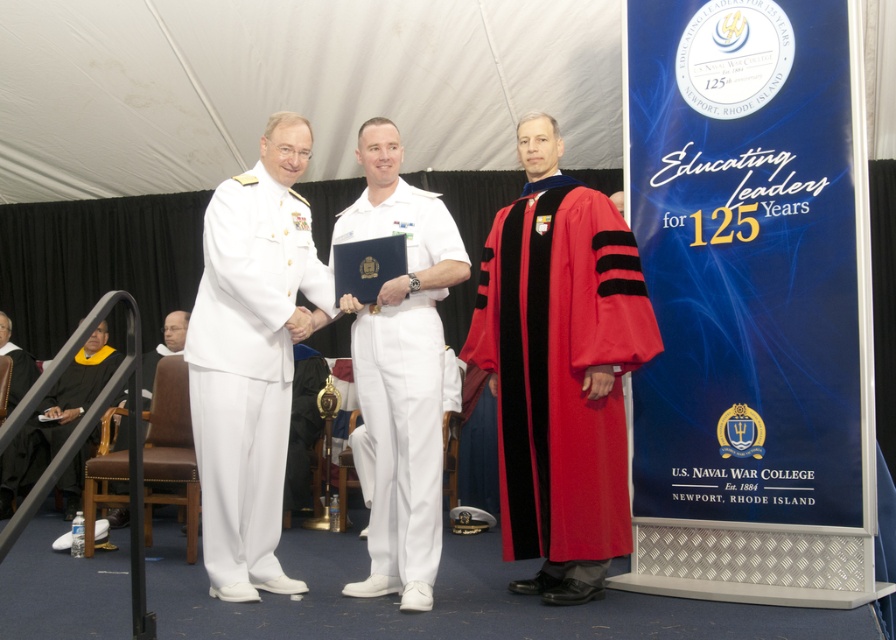
Please provide the 2D coordinates of the white cotton uniform at center in the scene.

The 2D coordinates of the white cotton uniform at center are at point (402, 432).

You are a photographer at the U.S. Naval War College anniversary event. You need to capture a photo of the white cotton dress uniform at left and the black matte graduation gown at lower left. The camera you are using has a minimum focus distance of 10 feet. Can you take the photo without moving either subject?

The white cotton dress uniform at left and the black matte graduation gown at lower left are 9.62 feet apart from each other. Since the camera requires a minimum focus distance of 10 feet, the subjects are too close to be captured clearly in the same frame without moving them.